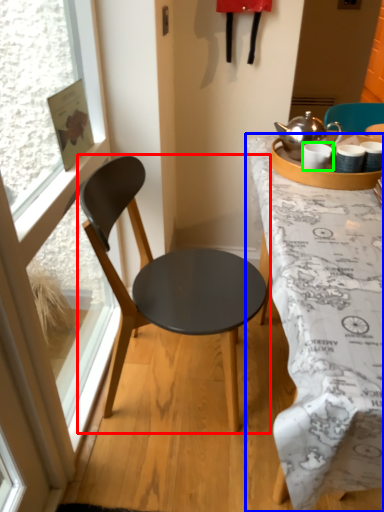
Question: Which object is positioned farthest from chair (highlighted by a red box)? Select from desk (highlighted by a blue box) and coffee cup (highlighted by a green box).

Choices:
 (A) desk
 (B) coffee cup

Answer: (B)